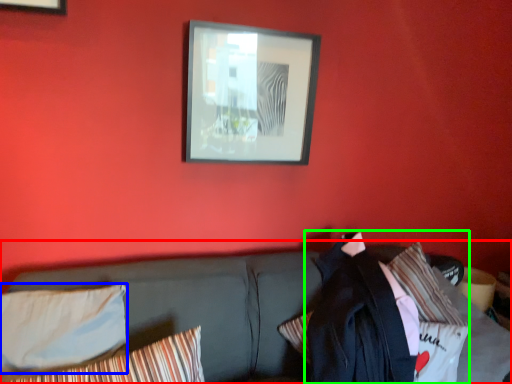
Question: Considering the real-world distances, which object is farthest from studio couch (highlighted by a red box)? pillow (highlighted by a blue box) or jacket (highlighted by a green box)?

Choices:
 (A) pillow
 (B) jacket

Answer: (B)